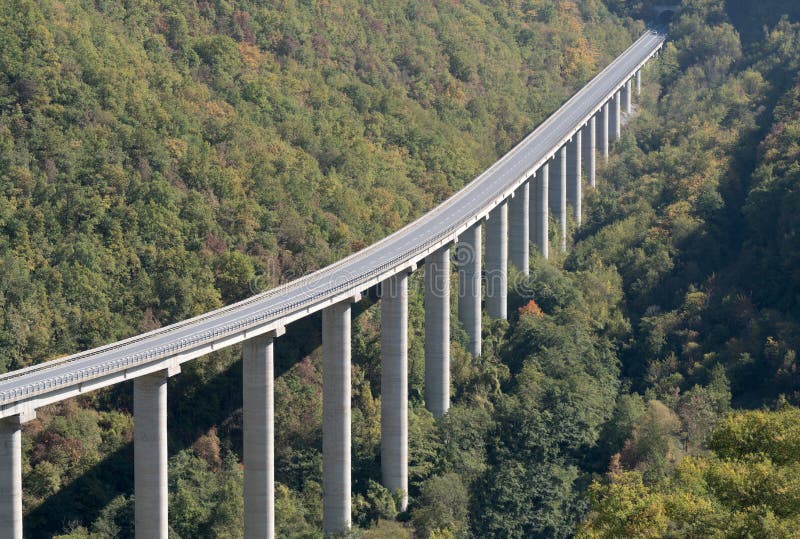
The image size is (800, 539). I want to click on pillars, so click(x=254, y=428), click(x=438, y=359), click(x=538, y=198).